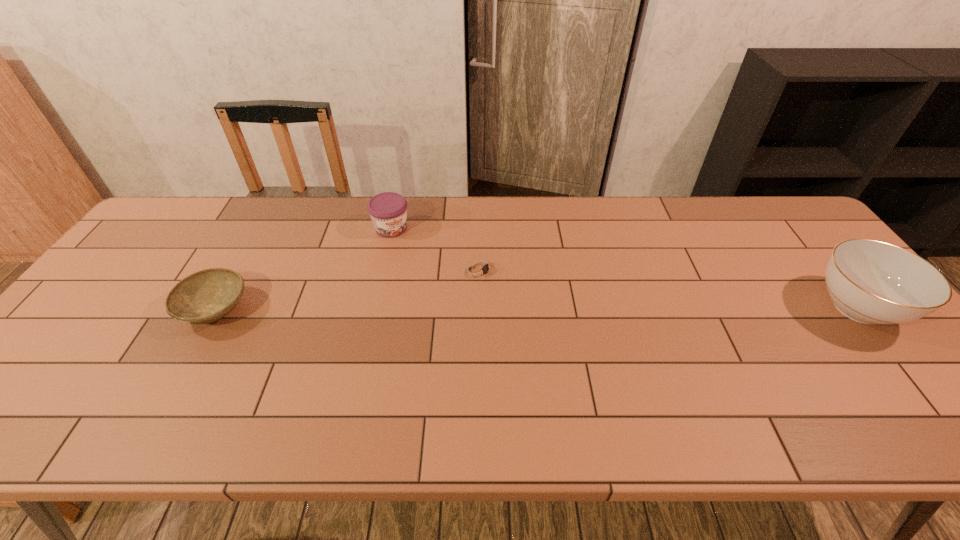
Find the location of `free space between the chinaware and the shortest object`. free space between the chinaware and the shortest object is located at coordinates (668, 288).

Where is `free space that is in between the watch and the bowl`? The height and width of the screenshot is (540, 960). free space that is in between the watch and the bowl is located at coordinates (348, 289).

Locate an element on the screen. free space between the rightmost object and the leftmost object is located at coordinates (537, 309).

Select which object appears as the closest to the shortest object. Please provide its 2D coordinates. Your answer should be formatted as a tuple, i.e. [(x, y)], where the tuple contains the x and y coordinates of a point satisfying the conditions above.

[(388, 211)]

Identify which object is the third nearest to the third object from left to right. Please provide its 2D coordinates. Your answer should be formatted as a tuple, i.e. [(x, y)], where the tuple contains the x and y coordinates of a point satisfying the conditions above.

[(873, 282)]

Where is `vacant space that satisfies the following two spatial constraints: 1. on the back side of the second shortest object; 2. on the right side of the watch`? Image resolution: width=960 pixels, height=540 pixels. vacant space that satisfies the following two spatial constraints: 1. on the back side of the second shortest object; 2. on the right side of the watch is located at coordinates (238, 269).